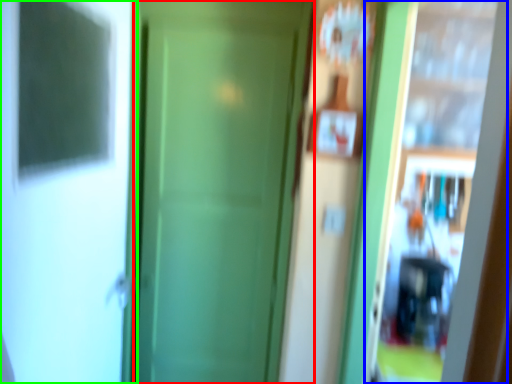
Question: Which is nearer to the door (highlighted by a red box)? screen door (highlighted by a blue box) or screen door (highlighted by a green box).

Choices:
 (A) screen door
 (B) screen door

Answer: (B)